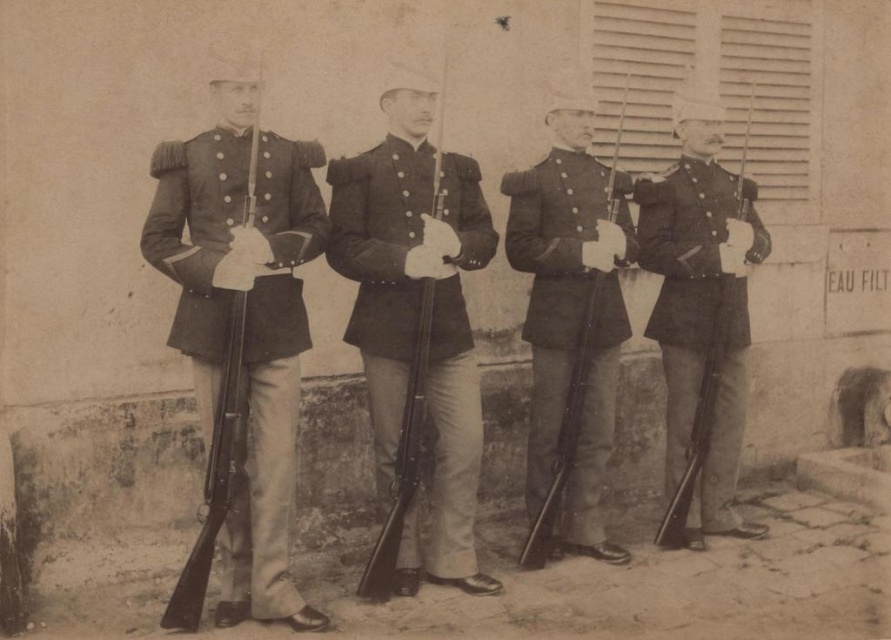
Does dark gray wool uniform at center appear over smooth dark fabric uniform at right?

Incorrect, dark gray wool uniform at center is not positioned above smooth dark fabric uniform at right.

Is the position of dark gray wool uniform at center less distant than that of smooth dark fabric uniform at right?

Yes, dark gray wool uniform at center is in front of smooth dark fabric uniform at right.

Does point (569, 161) come closer to viewer compared to point (720, 180)?

Yes, point (569, 161) is in front of point (720, 180).

Identify the location of dark gray wool uniform at center. (570, 324).

Between point (432, 484) and point (594, 440), which one is positioned behind?

The point (594, 440) is behind.

Is dark blue wool jacket at center to the right of dark gray wool uniform at center from the viewer's perspective?

Incorrect, dark blue wool jacket at center is not on the right side of dark gray wool uniform at center.

Between point (366, 369) and point (570, 508), which one is positioned in front?

Point (366, 369)

Identify the location of dark blue wool jacket at center. (415, 330).

Does matte black rifle at center have a smaller size compared to dark blue wool jacket at center?

Incorrect, matte black rifle at center is not smaller in size than dark blue wool jacket at center.

Which is behind, point (243, 221) or point (365, 205)?

Positioned behind is point (365, 205).

This screenshot has width=891, height=640. In order to click on matte black rifle at center in this screenshot , I will do `click(305, 323)`.

I want to click on matte black rifle at center, so click(x=305, y=323).